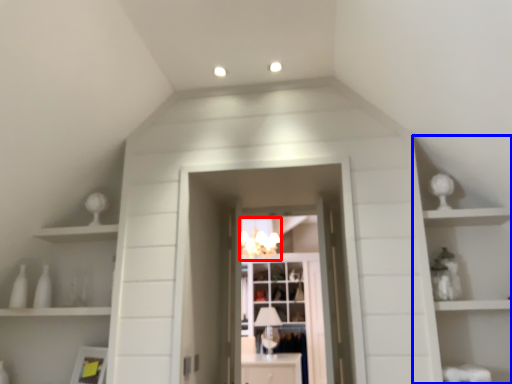
Question: Which of the following is the farthest to the observer, light fixture (highlighted by a red box) or cabinet (highlighted by a blue box)?

Choices:
 (A) light fixture
 (B) cabinet

Answer: (A)